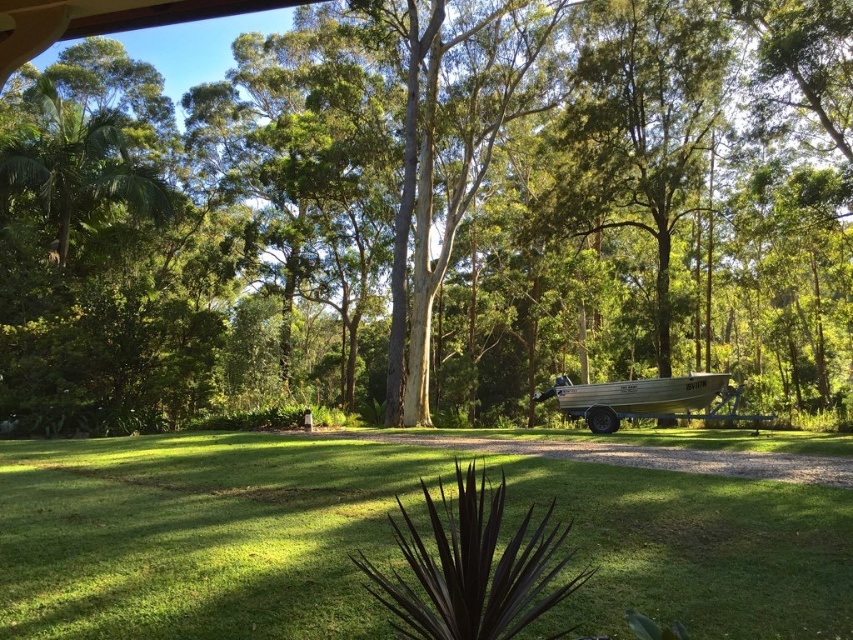
Measure the distance from green leafy tree at center to green grassy at center.

green leafy tree at center and green grassy at center are 13.24 meters apart from each other.

Does green leafy tree at center appear on the left side of green grassy at center?

Indeed, green leafy tree at center is positioned on the left side of green grassy at center.

This screenshot has width=853, height=640. Describe the element at coordinates (434, 212) in the screenshot. I see `green leafy tree at center` at that location.

This screenshot has width=853, height=640. I want to click on green leafy tree at center, so click(434, 212).

Is point (653, 244) positioned before point (635, 403)?

That is False.

Does green leafy tree at center have a lesser height compared to silver aluminum boat at center?

No.

Who is more distant from viewer, (374,285) or (653,413)?

The point (374,285) is behind.

Find the location of a particular element. Image resolution: width=853 pixels, height=640 pixels. green leafy tree at center is located at coordinates (434, 212).

Is green grassy at center taller than silver aluminum boat at center?

No, green grassy at center is not taller than silver aluminum boat at center.

Does point (802, 508) come closer to viewer compared to point (587, 406)?

Yes.

Is point (325, 628) positioned behind point (683, 417)?

No, it is in front of (683, 417).

This screenshot has width=853, height=640. Identify the location of green grassy at center. (199, 534).